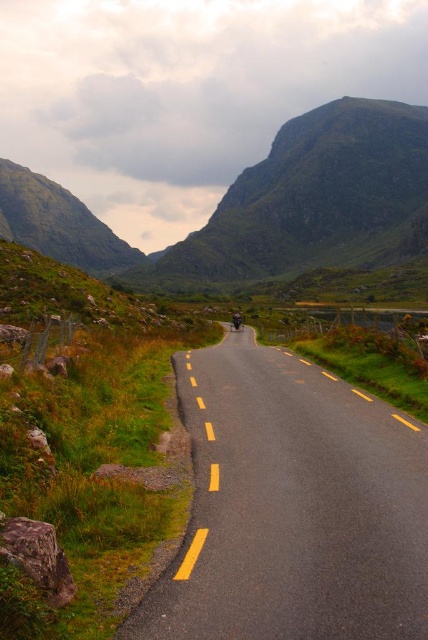
You are a delivery driver who needs to park your shiny silver motorcycle at center on the asphalt road at center. Is there enough space for the motorcycle to fit on the road?

The asphalt road at center is positioned under the shiny silver motorcycle at center, which means the motorcycle is already on the road. Therefore, there is sufficient space for the motorcycle to be parked there.

You are a hiker standing at the shiny silver motorcycle at center. Looking ahead, you see the green grassy mountain at upper center. Which direction should you head to reach the mountain?

To reach the green grassy mountain at upper center from the shiny silver motorcycle at center, you should head to the left since the green grassy mountain at upper center is located to the left of the motorcycle.

You are driving a car on the scenic road and see two points marked on your GPS. The first point is at coordinate point(175, 566) and the second is at point(388, 124). According to the scene description, which point is closer to your current position if you are driving towards the direction the road curves to the right?

Point(175, 566) is in front of point(388, 124), so if you are driving towards the direction the road curves to the right, point(175, 566) is closer to your current position.